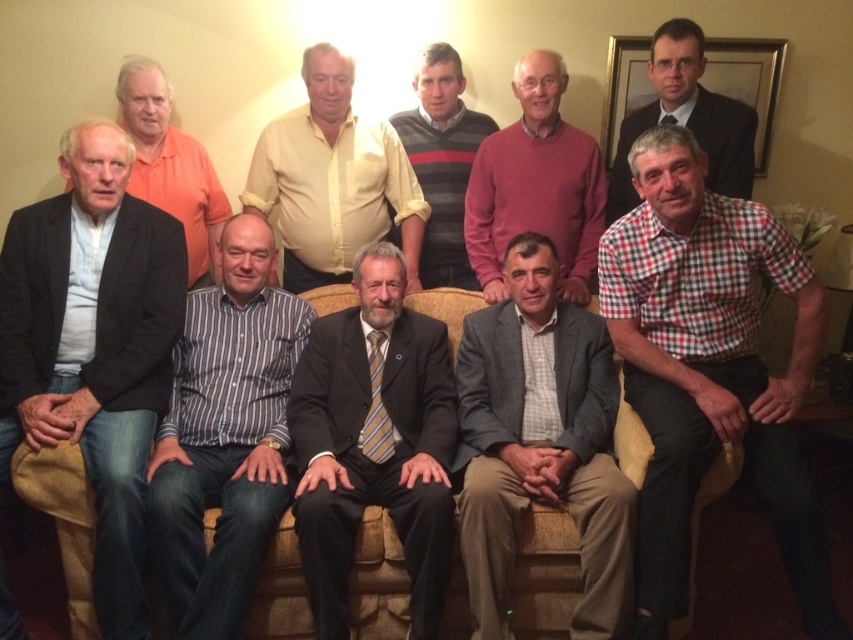
In the scene, there are two men wearing a black cotton jacket at left and a formal suit at upper right. Which one is positioned more to the left side of the image?

The black cotton jacket at left is positioned more to the left side of the image than the formal suit at upper right.

You are standing in the room where the photograph was taken. You see a point marked at coordinates (711, 369). Which object in the scene does this point correspond to?

The point at coordinates (711, 369) corresponds to the red checkered shirt at lower right.